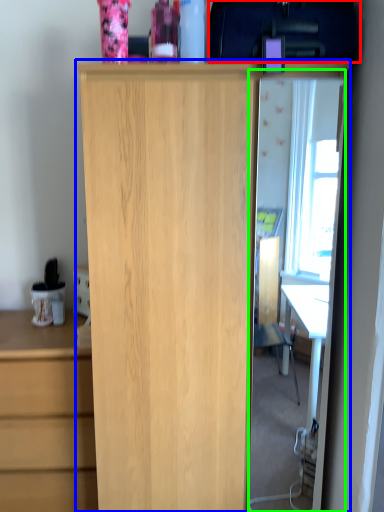
Question: Considering the real-world distances, which object is farthest from back (highlighted by a red box)? cupboard (highlighted by a blue box) or glass door (highlighted by a green box)?

Choices:
 (A) cupboard
 (B) glass door

Answer: (B)